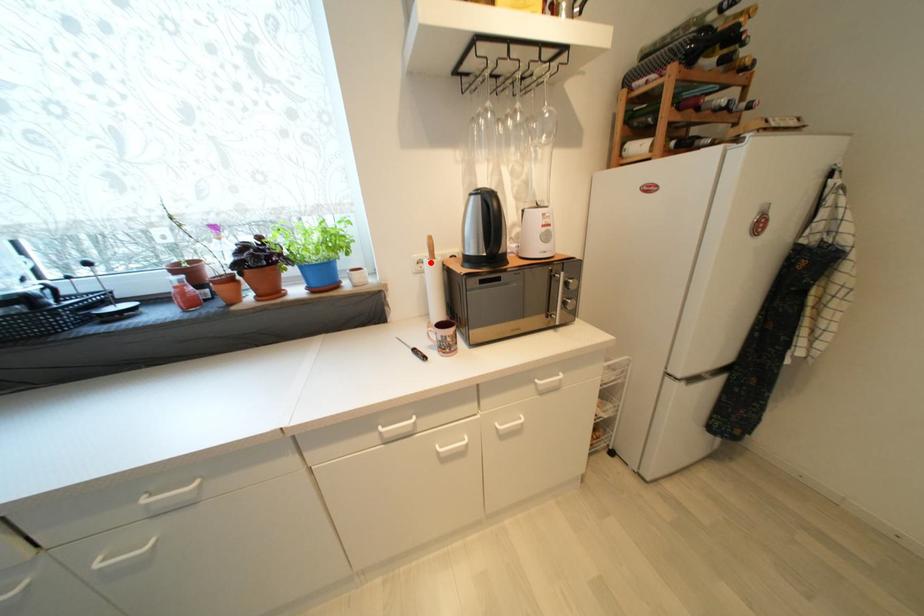
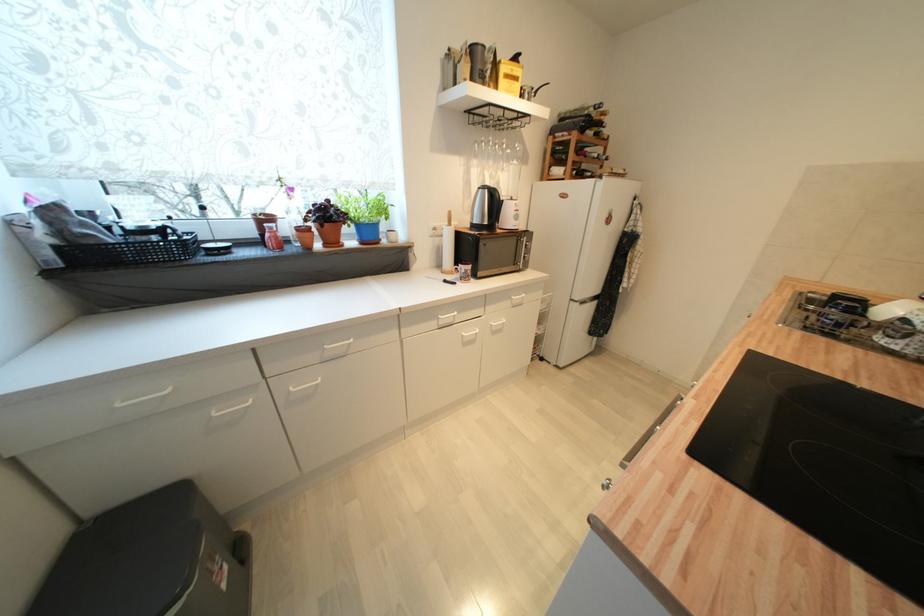
Where in the second image is the point corresponding to the highlighted location from the first image?

(450, 229)